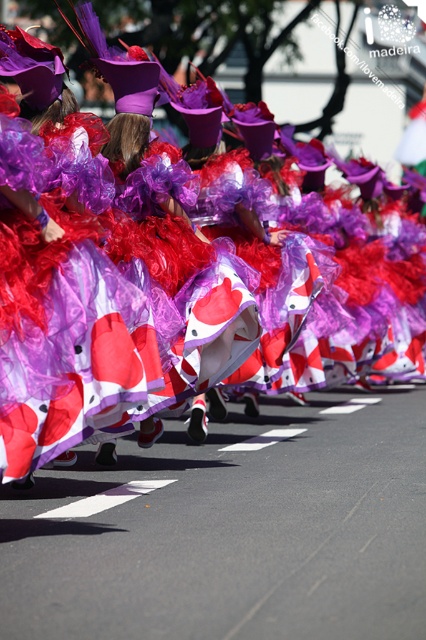
You are a photographer trying to capture the performers in the parade. You notice the matte purple fabric at center and the white solid line at center. Which object is positioned higher in the image?

The matte purple fabric at center is located above the white solid line at center, so it is positioned higher in the image.

You are a photographer trying to capture the performers in the parade. You notice the matte purple fabric at center and the white solid line at center. Which object is higher in the image?

The matte purple fabric at center is taller than the white solid line at center, so the matte purple fabric at center is higher in the image.

You are a photographer standing at the center of the street, facing the performers. You want to take a photo that includes both the point at coordinates point (x=51, y=324) and point (x=141, y=483). Which point should you focus on first to ensure both are in focus?

You should focus on point (x=51, y=324) first because it is closer to the camera than point (x=141, y=483). By focusing on the closer point, the farther point will also be within the depth of field and in focus.